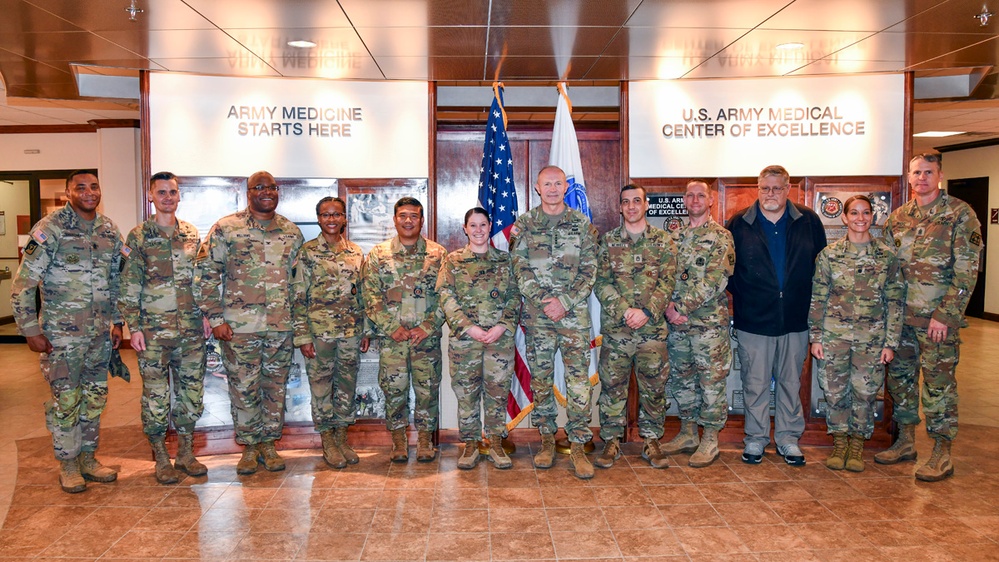
Where is `wooden door`? The image size is (999, 562). wooden door is located at coordinates (959, 185).